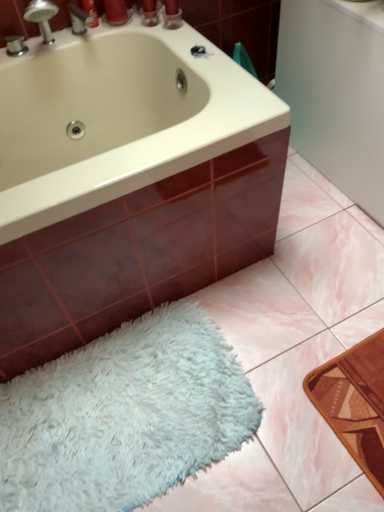
Question: From a real-world perspective, relative to white glossy bathtub at upper left, is white fluffy bath mat at lower left vertically above or below?

Choices:
 (A) above
 (B) below

Answer: (B)

Question: Looking at their shapes, would you say white fluffy bath mat at lower left is wider or thinner than white glossy bathtub at upper left?

Choices:
 (A) wide
 (B) thin

Answer: (B)

Question: Which object is the closest to the white fluffy bath mat at lower left?

Choices:
 (A) brushed metal faucet at upper left
 (B) white glossy bathtub at upper left

Answer: (B)

Question: Which is nearer to the white fluffy bath mat at lower left?

Choices:
 (A) white glossy bathtub at upper left
 (B) brushed metal faucet at upper left

Answer: (A)